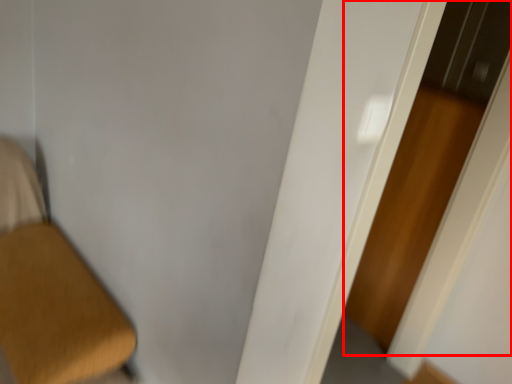
Question: From the image's perspective, what is the correct spatial relationship of screen door (annotated by the red box) in relation to door?

Choices:
 (A) above
 (B) below

Answer: (A)